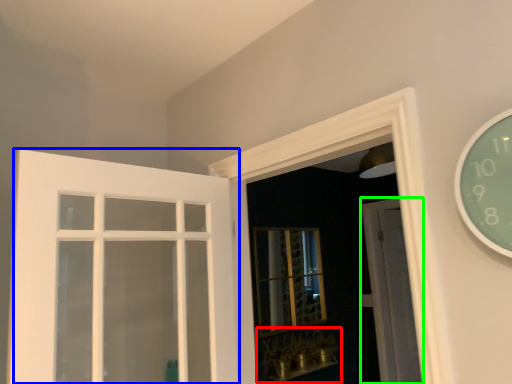
Question: Which is nearer to the window sill (highlighted by a red box)? door (highlighted by a blue box) or door (highlighted by a green box).

Choices:
 (A) door
 (B) door

Answer: (B)